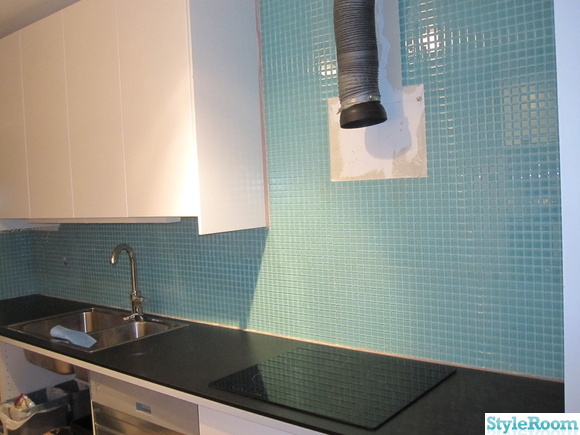
I want to click on counter, so click(x=226, y=334).